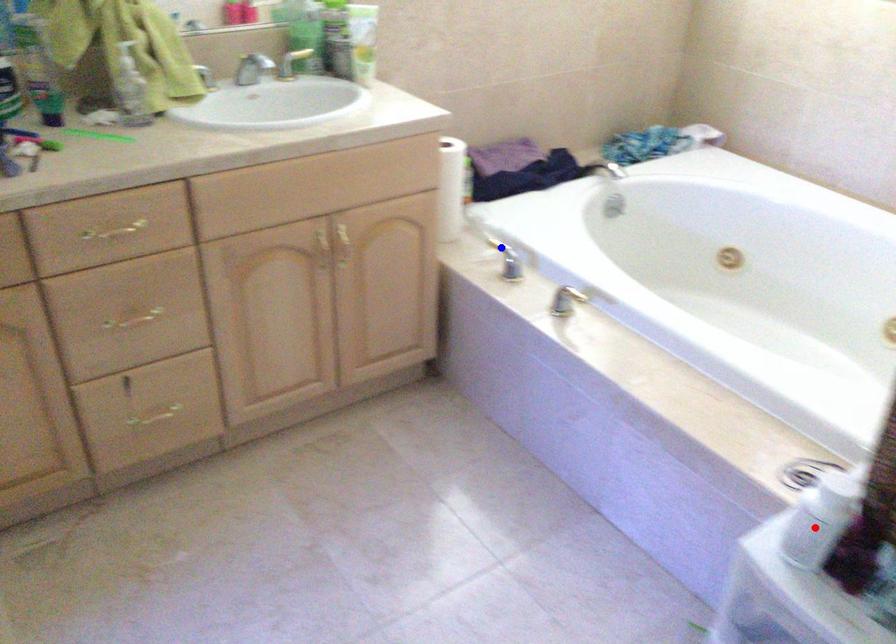
Question: Which of the two points in the image is closer to the camera?

Choices:
 (A) Blue point is closer.
 (B) Red point is closer.

Answer: (B)